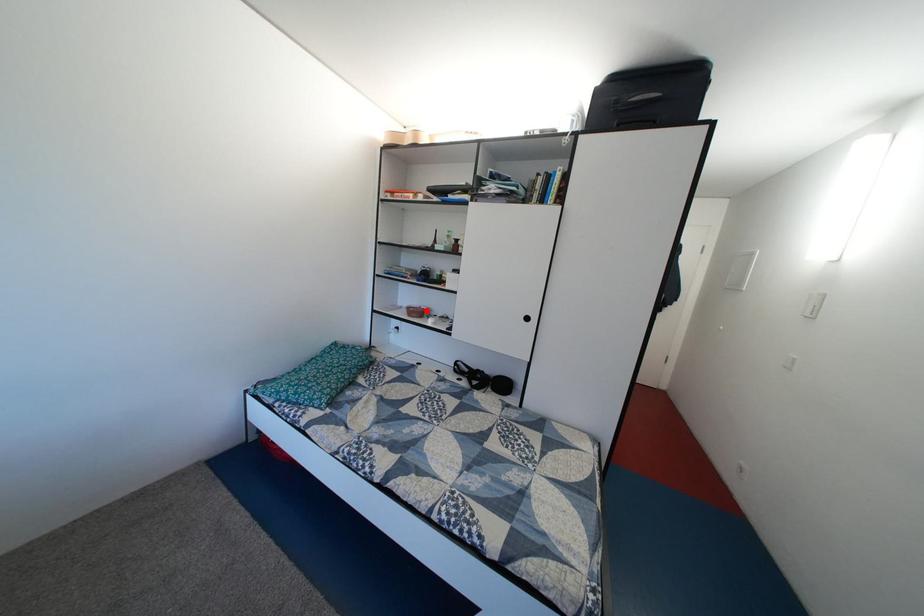
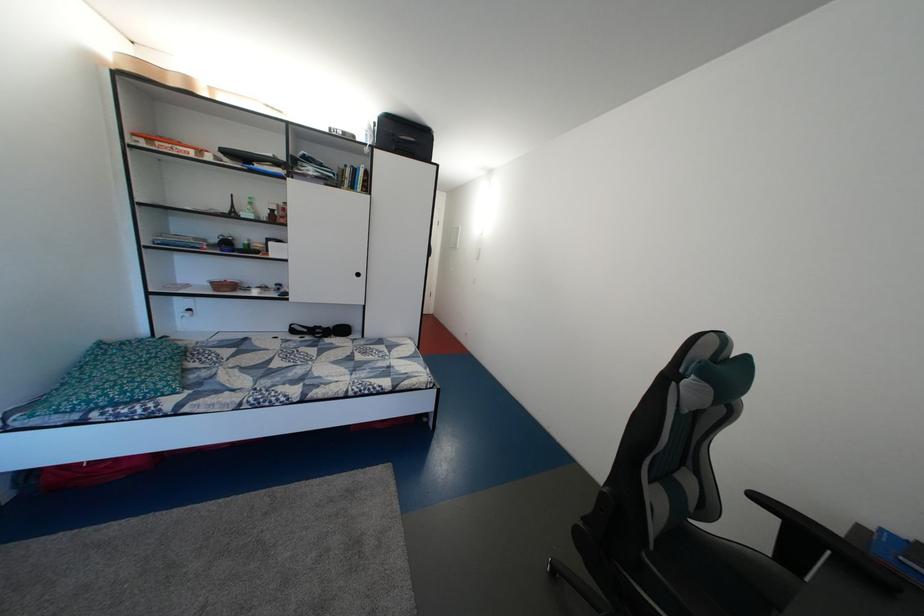
In the second image, find the point that corresponds to the highlighted location in the first image.

(228, 284)